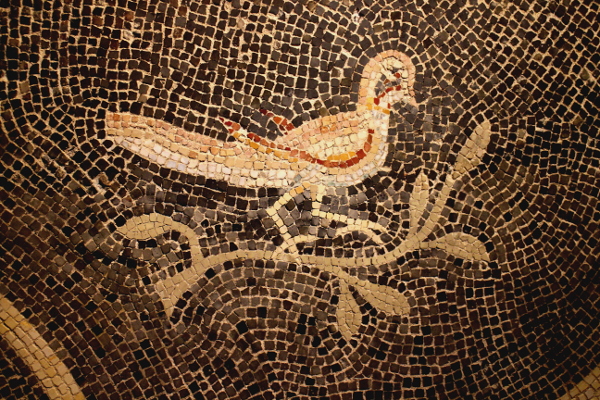
Find the location of a particular element. The width and height of the screenshot is (600, 400). light brown tile is located at coordinates point(106,340).